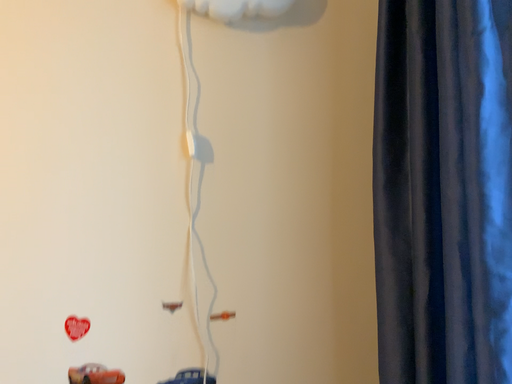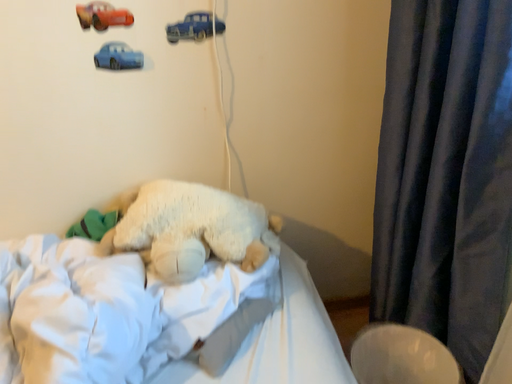
Question: Which way did the camera rotate in the video?

Choices:
 (A) rotated upward
 (B) rotated downward

Answer: (B)